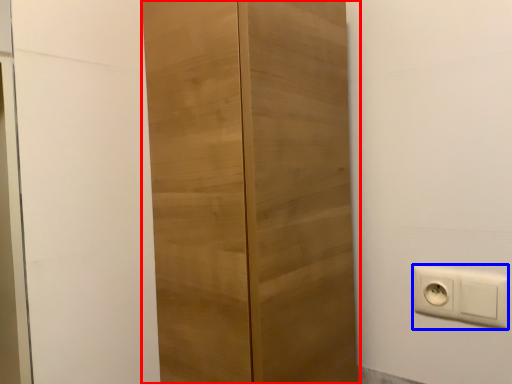
Question: Which point is further to the camera, cupboard (highlighted by a red box) or power plugs and sockets (highlighted by a blue box)?

Choices:
 (A) cupboard
 (B) power plugs and sockets

Answer: (B)